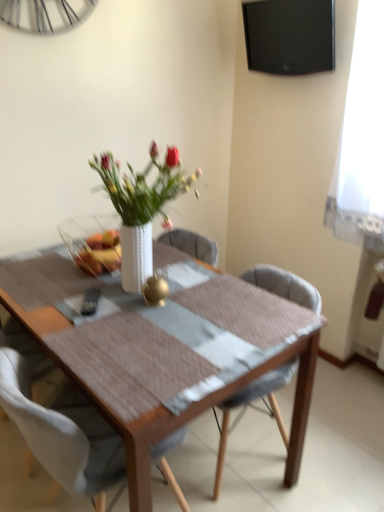
The image size is (384, 512). Describe the element at coordinates (157, 354) in the screenshot. I see `wooden table at center` at that location.

You are a GUI agent. You are given a task and a screenshot of the screen. Output one action in this format:
    pyautogui.click(x=<x>, y=<y>)
    Task: Click on the light gray fabric chair at center, the 2th chair from the left
    
    Given the screenshot: What is the action you would take?
    pyautogui.click(x=253, y=408)

In order to click on wooden table at center in this screenshot , I will do `click(157, 354)`.

Between wooden table at center and light gray fabric chair at center, the 2th chair from the left, which one appears on the left side from the viewer's perspective?

wooden table at center.

From the image's perspective, which one is positioned lower, wooden table at center or light gray fabric chair at center, the 2th chair from the left?

light gray fabric chair at center, the 2th chair from the left.

Is wooden table at center oriented towards light gray fabric chair at center, the 1th chair in the right-to-left sequence?

No, wooden table at center is not facing towards light gray fabric chair at center, the 1th chair in the right-to-left sequence.

From a real-world perspective, is black glossy tv at upper right over translucent glass bowl at center?

Correct, in the physical world, black glossy tv at upper right is higher than translucent glass bowl at center.

Which is more to the right, black glossy tv at upper right or translucent glass bowl at center?

Positioned to the right is black glossy tv at upper right.

Is black glossy tv at upper right positioned in front of translucent glass bowl at center?

No, it is not.

Considering the relative sizes of black glossy tv at upper right and translucent glass bowl at center in the image provided, is black glossy tv at upper right shorter than translucent glass bowl at center?

In fact, black glossy tv at upper right may be taller than translucent glass bowl at center.

Is white fabric chair at center, arranged as the second chair when viewed from the right, outside of translucent glass bowl at center?

Yes, white fabric chair at center, arranged as the second chair when viewed from the right, is not within translucent glass bowl at center.

From the image's perspective, is white fabric chair at center, marked as the first chair in a left-to-right arrangement, located above or below translucent glass bowl at center?

Based on their image positions, white fabric chair at center, marked as the first chair in a left-to-right arrangement, is located beneath translucent glass bowl at center.

Is point (50, 420) positioned in front of point (110, 232)?

That is True.

Is white fabric chair at center, marked as the first chair in a left-to-right arrangement, looking in the opposite direction of translucent glass bowl at center?

No, white fabric chair at center, marked as the first chair in a left-to-right arrangement,'s orientation is not away from translucent glass bowl at center.

Which object is positioned more to the left, translucent glass bowl at center or light gray fabric chair at center, the 1th chair in the right-to-left sequence?

From the viewer's perspective, translucent glass bowl at center appears more on the left side.

Is the depth of translucent glass bowl at center less than that of light gray fabric chair at center, the 1th chair in the right-to-left sequence?

No.

From a real-world perspective, is translucent glass bowl at center positioned over light gray fabric chair at center, the 1th chair in the right-to-left sequence, based on gravity?

Yes.

Are translucent glass bowl at center and light gray fabric chair at center, the 2th chair from the left, beside each other?

They are not placed beside each other.

Between black glossy tv at upper right and white fabric chair at center, arranged as the second chair when viewed from the right, which one has larger width?

white fabric chair at center, arranged as the second chair when viewed from the right, is wider.

Between black glossy tv at upper right and white fabric chair at center, marked as the first chair in a left-to-right arrangement, which one has less height?

With less height is black glossy tv at upper right.

Does point (277, 58) come farther from viewer compared to point (52, 472)?

Yes, it is behind point (52, 472).

How many degrees apart are the facing directions of black glossy tv at upper right and white fabric chair at center, marked as the first chair in a left-to-right arrangement?

They differ by 179 degrees in their facing directions.

Which object is positioned more to the right, white fabric chair at center, arranged as the second chair when viewed from the right, or light gray fabric chair at center, the 2th chair from the left?

From the viewer's perspective, light gray fabric chair at center, the 2th chair from the left, appears more on the right side.

In the scene shown: Can light gray fabric chair at center, the 1th chair in the right-to-left sequence, be found inside white fabric chair at center, marked as the first chair in a left-to-right arrangement?

Definitely not — light gray fabric chair at center, the 1th chair in the right-to-left sequence, is not inside white fabric chair at center, marked as the first chair in a left-to-right arrangement.

Consider the image. Can you tell me how much white fabric chair at center, marked as the first chair in a left-to-right arrangement, and light gray fabric chair at center, the 2th chair from the left, differ in facing direction?

The angle between the facing direction of white fabric chair at center, marked as the first chair in a left-to-right arrangement, and the facing direction of light gray fabric chair at center, the 2th chair from the left, is 180 degrees.

Are white fabric chair at center, marked as the first chair in a left-to-right arrangement, and light gray fabric chair at center, the 2th chair from the left, located far from each other?

No.

Which of these two, light gray fabric chair at center, the 1th chair in the right-to-left sequence, or black glossy tv at upper right, is smaller?

With smaller size is black glossy tv at upper right.

Is light gray fabric chair at center, the 2th chair from the left, wider or thinner than black glossy tv at upper right?

Clearly, light gray fabric chair at center, the 2th chair from the left, has more width compared to black glossy tv at upper right.

I want to click on the 1st chair in front of the black glossy tv at upper right, counting from the anchor's position, so click(253, 408).

The width and height of the screenshot is (384, 512). Identify the location of chair on the right of wooden table at center. (253, 408).

In the image, there is a translucent glass bowl at center. Where is `television above it (from the image's perspective)`? television above it (from the image's perspective) is located at coordinates (290, 36).

When comparing their distances from black glossy tv at upper right, does wooden table at center or translucent glass bowl at center seem further?

wooden table at center.

Looking at the image, which one is located further to wooden table at center, translucent glass bowl at center or light gray fabric chair at center, the 2th chair from the left?

translucent glass bowl at center is further to wooden table at center.

From the image, which object appears to be farther from wooden table at center, black glossy tv at upper right or white fabric chair at center, arranged as the second chair when viewed from the right?

black glossy tv at upper right is positioned further to the anchor wooden table at center.

From the image, which object appears to be nearer to white fabric chair at center, marked as the first chair in a left-to-right arrangement, wooden table at center or black glossy tv at upper right?

wooden table at center is positioned closer to the anchor white fabric chair at center, marked as the first chair in a left-to-right arrangement.

Considering their positions, is white fabric chair at center, arranged as the second chair when viewed from the right, positioned closer to wooden table at center than translucent glass bowl at center?

white fabric chair at center, arranged as the second chair when viewed from the right, is positioned closer to the anchor wooden table at center.

Based on their spatial positions, is translucent glass bowl at center or wooden table at center closer to black glossy tv at upper right?

translucent glass bowl at center is closer to black glossy tv at upper right.

Looking at the image, which one is located closer to light gray fabric chair at center, the 2th chair from the left, wooden table at center or black glossy tv at upper right?

wooden table at center lies closer to light gray fabric chair at center, the 2th chair from the left, than the other object.

From the image, which object appears to be farther from translucent glass bowl at center, wooden table at center or black glossy tv at upper right?

The object further to translucent glass bowl at center is black glossy tv at upper right.

The image size is (384, 512). In order to click on food between black glossy tv at upper right and wooden table at center vertically in this screenshot , I will do `click(99, 253)`.

Image resolution: width=384 pixels, height=512 pixels. In order to click on kitchen & dining room table located between white fabric chair at center, arranged as the second chair when viewed from the right, and light gray fabric chair at center, the 2th chair from the left, in the left-right direction in this screenshot , I will do `click(157, 354)`.

This screenshot has width=384, height=512. What are the coordinates of `chair between white fabric chair at center, marked as the first chair in a left-to-right arrangement, and translucent glass bowl at center from front to back` in the screenshot? It's located at (253, 408).

Where is `food between black glossy tv at upper right and light gray fabric chair at center, the 2th chair from the left, in the up-down direction`? The height and width of the screenshot is (512, 384). food between black glossy tv at upper right and light gray fabric chair at center, the 2th chair from the left, in the up-down direction is located at coordinates (99, 253).